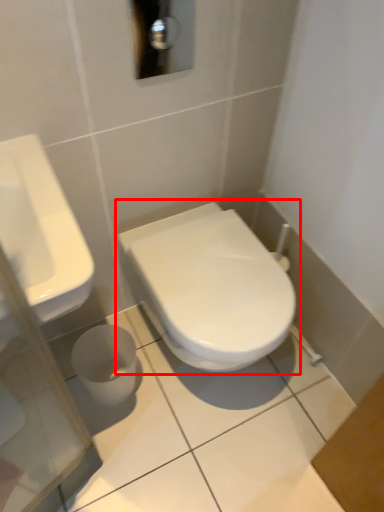
Question: Where is toilet (annotated by the red box) located in relation to sink in the image?

Choices:
 (A) right
 (B) left

Answer: (A)